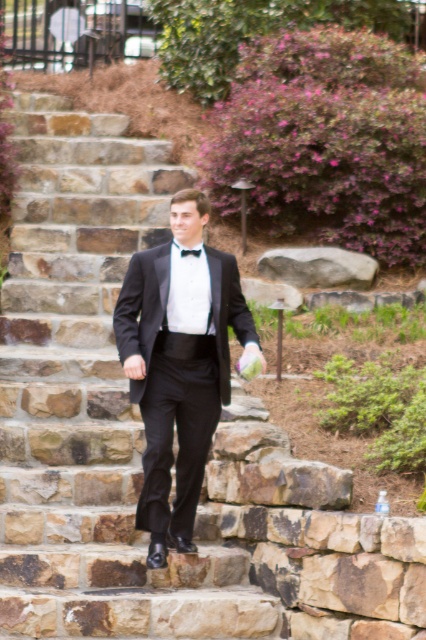
Who is more distant from viewer, [218,634] or [183,234]?

The point [183,234] is behind.

Does point (114, 136) come behind point (195, 548)?

Yes, point (114, 136) is behind point (195, 548).

This screenshot has width=426, height=640. Find the location of `smooth stone stairs at center`. smooth stone stairs at center is located at coordinates (92, 401).

Between point (118, 332) and point (181, 250), which one is positioned behind?

Positioned behind is point (181, 250).

Can you confirm if black satin tuxedo at center is smaller than black satin bow tie at center?

No, black satin tuxedo at center is not smaller than black satin bow tie at center.

Between point (163, 272) and point (180, 253), which one is positioned in front?

Point (163, 272)

Image resolution: width=426 pixels, height=640 pixels. I want to click on black satin tuxedo at center, so click(x=178, y=364).

Does smooth stone stairs at center have a smaller size compared to black satin bow tie at center?

Incorrect, smooth stone stairs at center is not smaller in size than black satin bow tie at center.

Between point (68, 192) and point (183, 250), which one is positioned behind?

Positioned behind is point (68, 192).

In order to click on smooth stone stairs at center in this screenshot , I will do [x=92, y=401].